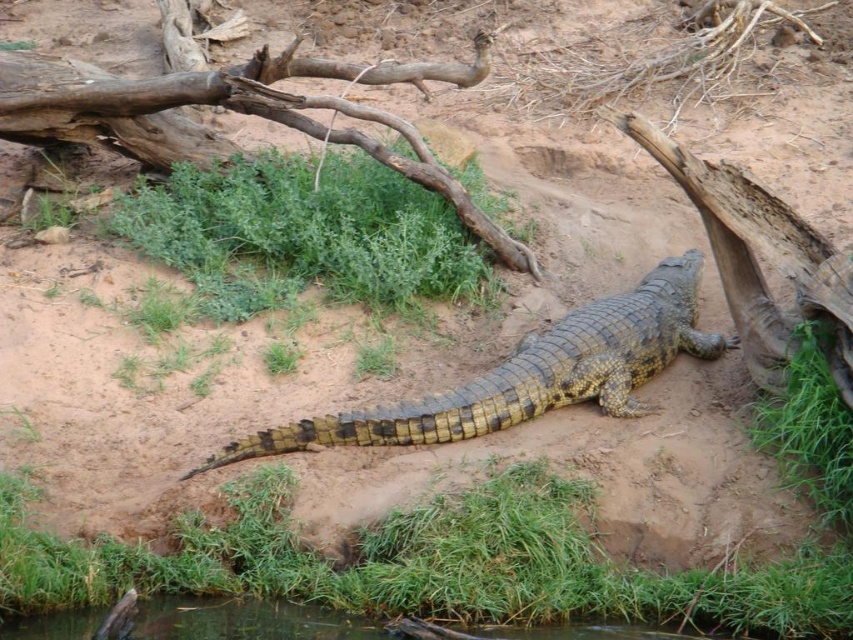
Question: Can you confirm if yellow-green scaly crocodile at center is positioned above clear water at bottom?

Choices:
 (A) yes
 (B) no

Answer: (A)

Question: Is yellow-green scaly crocodile at center to the right of clear water at bottom from the viewer's perspective?

Choices:
 (A) no
 (B) yes

Answer: (B)

Question: Which point appears farthest from the camera in this image?

Choices:
 (A) (558, 630)
 (B) (648, 307)

Answer: (B)

Question: Is yellow-green scaly crocodile at center in front of clear water at bottom?

Choices:
 (A) no
 (B) yes

Answer: (A)

Question: Which object appears farthest from the camera in this image?

Choices:
 (A) clear water at bottom
 (B) yellow-green scaly crocodile at center

Answer: (B)